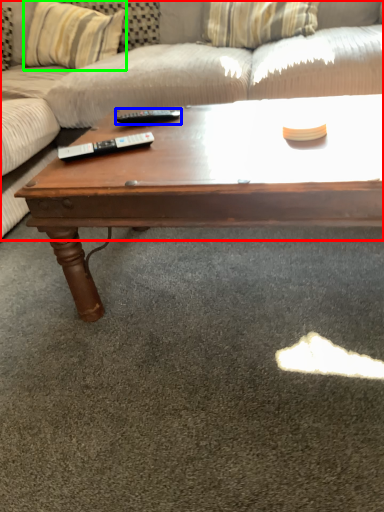
Question: Which object is the farthest from studio couch (highlighted by a red box)? Choose among these: remote (highlighted by a blue box) or pillow (highlighted by a green box).

Choices:
 (A) remote
 (B) pillow

Answer: (A)